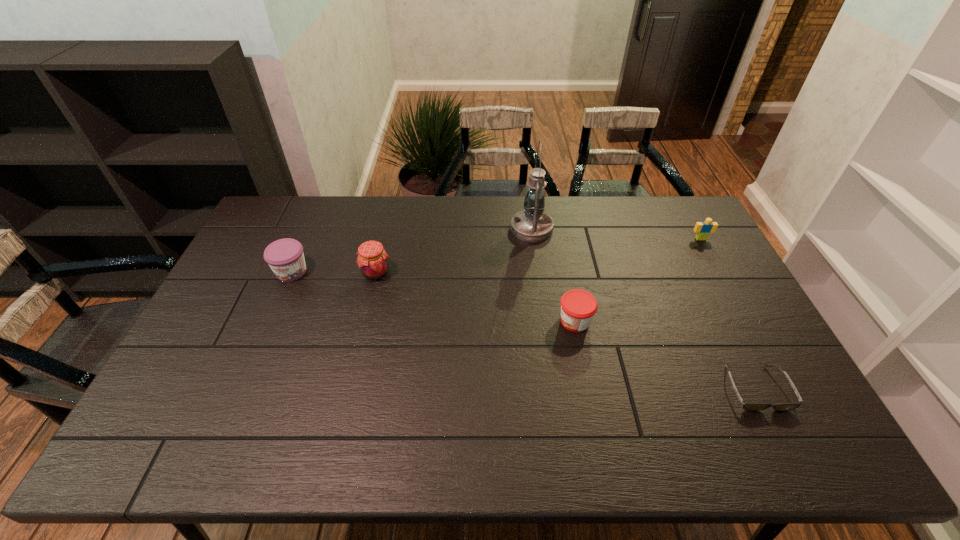
At what (x,y) coordinates should I click in order to perform the action: click on oil lamp. Please return your answer as a coordinate pair (x, y). The image size is (960, 540). Looking at the image, I should click on (532, 224).

At what (x,y) coordinates should I click in order to perform the action: click on the second jam from left to right. Please return your answer as a coordinate pair (x, y). The image size is (960, 540). Looking at the image, I should click on (372, 259).

This screenshot has width=960, height=540. Identify the location of the leftmost jam. (285, 257).

What are the coordinates of `Lego` in the screenshot? It's located at (702, 229).

Locate an element on the screen. the nearest jam is located at coordinates (578, 307).

This screenshot has width=960, height=540. In order to click on the fifth farthest object in this screenshot , I will do `click(578, 307)`.

At what (x,y) coordinates should I click in order to perform the action: click on the shortest object. Please return your answer as a coordinate pair (x, y). Looking at the image, I should click on (746, 406).

Where is `the nearest object`? This screenshot has height=540, width=960. the nearest object is located at coordinates (746, 406).

Where is `vacant space located on the left of the tallest object`? The width and height of the screenshot is (960, 540). vacant space located on the left of the tallest object is located at coordinates (424, 228).

The width and height of the screenshot is (960, 540). Identify the location of vacant space located on the left of the second object from left to right. (299, 273).